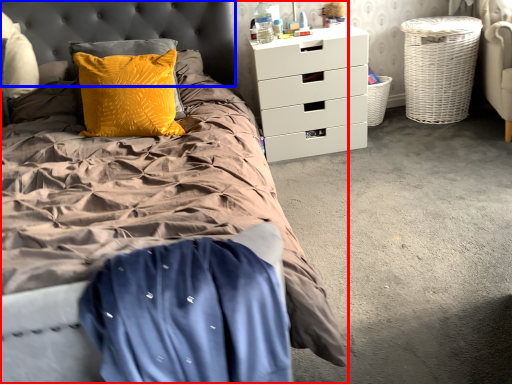
Question: Which point is closer to the camera, bed (highlighted by a red box) or headboard (highlighted by a blue box)?

Choices:
 (A) bed
 (B) headboard

Answer: (A)